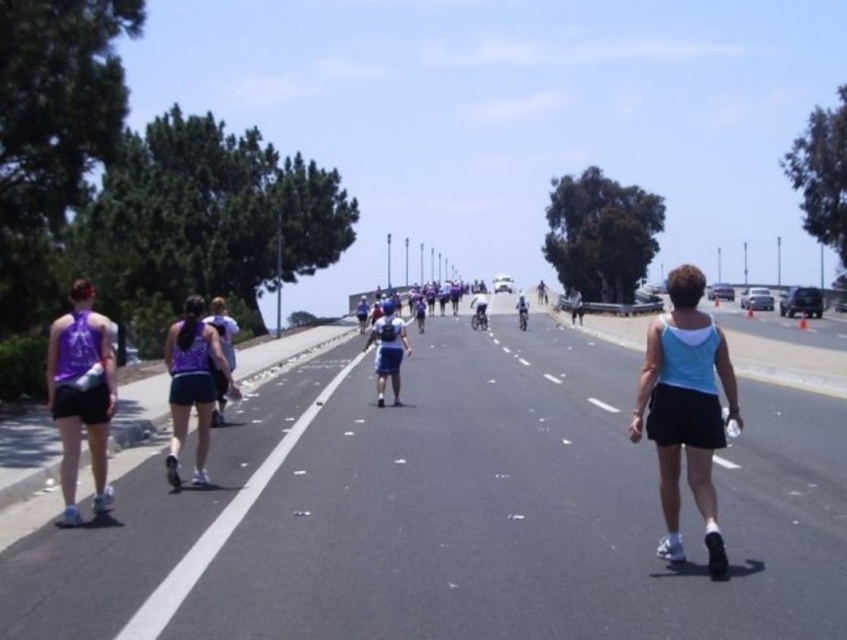
Is blue fabric tank top at center-right behind matte purple tank top at center-left?

That is False.

Which is behind, point (674, 342) or point (202, 400)?

Point (202, 400)

The height and width of the screenshot is (640, 847). What do you see at coordinates (685, 410) in the screenshot?
I see `blue fabric tank top at center-right` at bounding box center [685, 410].

Where is `blue fabric tank top at center-right`? blue fabric tank top at center-right is located at coordinates 685,410.

Who is positioned more to the left, black asphalt road at center or shiny silver bicycle at center?

black asphalt road at center

Is point (810, 588) farther from viewer compared to point (527, 307)?

No.

Is point (458, 634) less distant than point (518, 316)?

Yes, it is in front of point (518, 316).

The width and height of the screenshot is (847, 640). I want to click on black asphalt road at center, so click(452, 513).

Where is `purple fabric tank top at left`? The image size is (847, 640). purple fabric tank top at left is located at coordinates (81, 394).

Is purple fabric tank top at left thinner than blue fabric skateboard at center?

Correct, purple fabric tank top at left's width is less than blue fabric skateboard at center's.

Does point (113, 410) come in front of point (383, 321)?

Yes.

Where is `purple fabric tank top at left`? This screenshot has height=640, width=847. purple fabric tank top at left is located at coordinates (x=81, y=394).